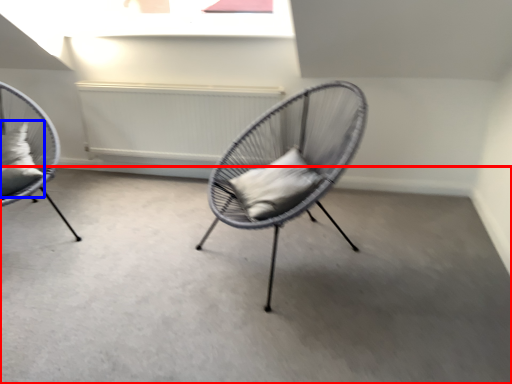
Question: Among these objects, which one is nearest to the camera, concrete (highlighted by a red box) or pillow (highlighted by a blue box)?

Choices:
 (A) concrete
 (B) pillow

Answer: (A)